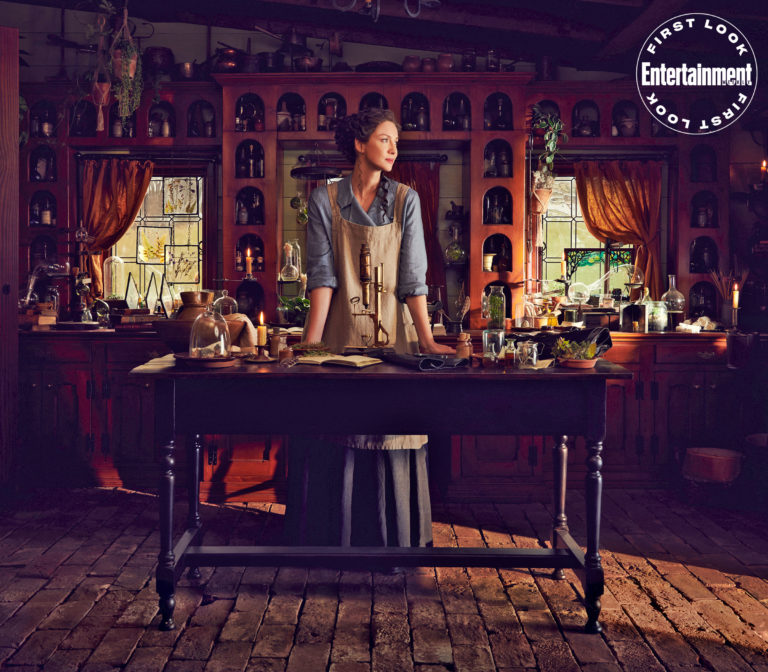
I want to click on legs of table, so (x=164, y=458), (x=194, y=461), (x=560, y=470), (x=594, y=468).